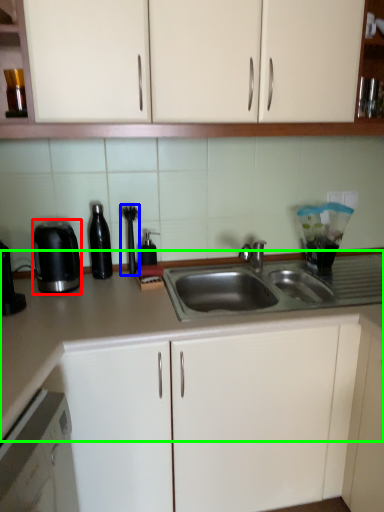
Question: Considering the real-world distances, which object is farthest from kitchen appliance (highlighted by a red box)? appliance (highlighted by a blue box) or countertop (highlighted by a green box)?

Choices:
 (A) appliance
 (B) countertop

Answer: (A)